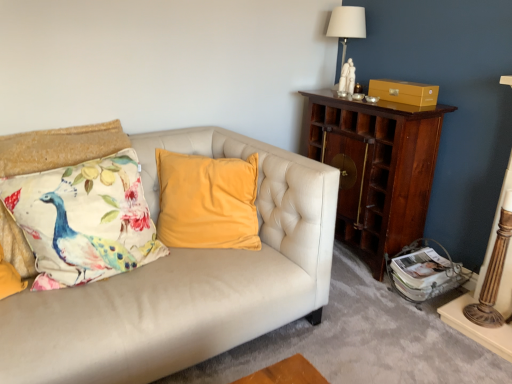
Where is `vacant space in front of wooden cabinet at right`? The height and width of the screenshot is (384, 512). vacant space in front of wooden cabinet at right is located at coordinates (373, 300).